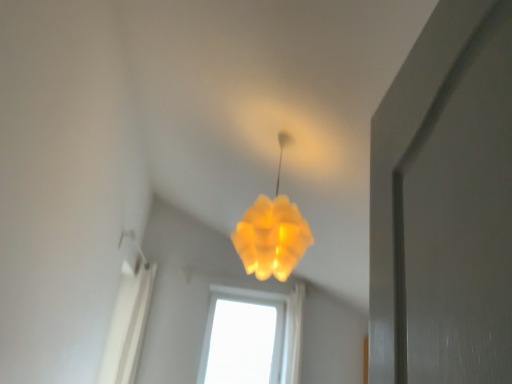
Question: Is the position of transparent glass window at center less distant than that of translucent yellow lampshade at center?

Choices:
 (A) no
 (B) yes

Answer: (A)

Question: Are transparent glass window at center and translucent yellow lampshade at center far apart?

Choices:
 (A) no
 (B) yes

Answer: (B)

Question: Is transparent glass window at center bigger than translucent yellow lampshade at center?

Choices:
 (A) yes
 (B) no

Answer: (B)

Question: Can you confirm if transparent glass window at center is shorter than translucent yellow lampshade at center?

Choices:
 (A) no
 (B) yes

Answer: (A)

Question: Is transparent glass window at center at the right side of translucent yellow lampshade at center?

Choices:
 (A) yes
 (B) no

Answer: (B)

Question: From a real-world perspective, is transparent glass window at center below translucent yellow lampshade at center?

Choices:
 (A) yes
 (B) no

Answer: (A)

Question: Is transparent glass window at center surrounded by translucent yellow lampshade at center?

Choices:
 (A) yes
 (B) no

Answer: (B)

Question: Can you see translucent yellow lampshade at center touching transparent glass window at center?

Choices:
 (A) yes
 (B) no

Answer: (B)

Question: Can you confirm if translucent yellow lampshade at center is wider than transparent glass window at center?

Choices:
 (A) yes
 (B) no

Answer: (A)

Question: Is translucent yellow lampshade at center looking in the opposite direction of transparent glass window at center?

Choices:
 (A) yes
 (B) no

Answer: (B)

Question: Considering the relative sizes of translucent yellow lampshade at center and transparent glass window at center in the image provided, is translucent yellow lampshade at center smaller than transparent glass window at center?

Choices:
 (A) yes
 (B) no

Answer: (B)

Question: From a real-world perspective, is translucent yellow lampshade at center on top of transparent glass window at center?

Choices:
 (A) no
 (B) yes

Answer: (B)

Question: Is translucent yellow lampshade at center wider or thinner than transparent glass window at center?

Choices:
 (A) thin
 (B) wide

Answer: (B)